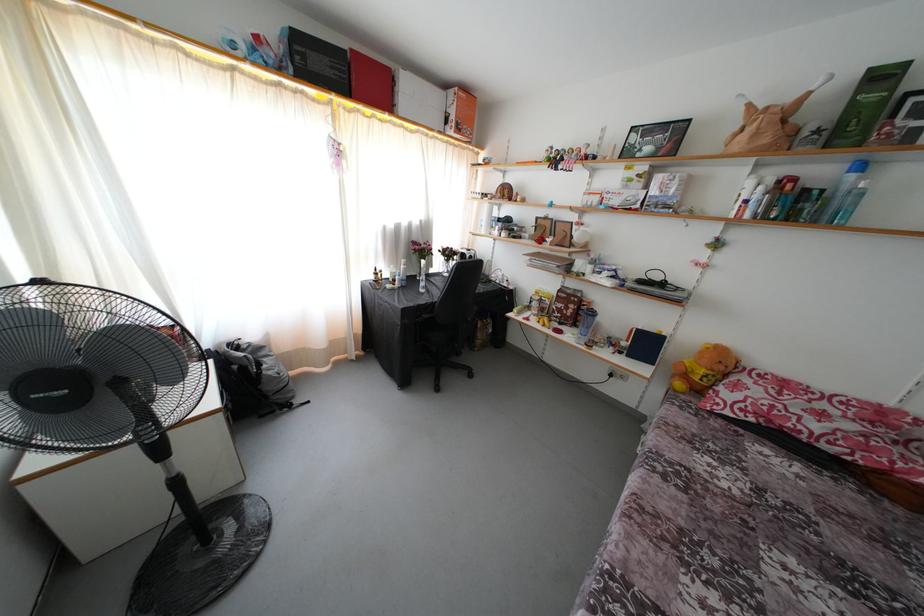
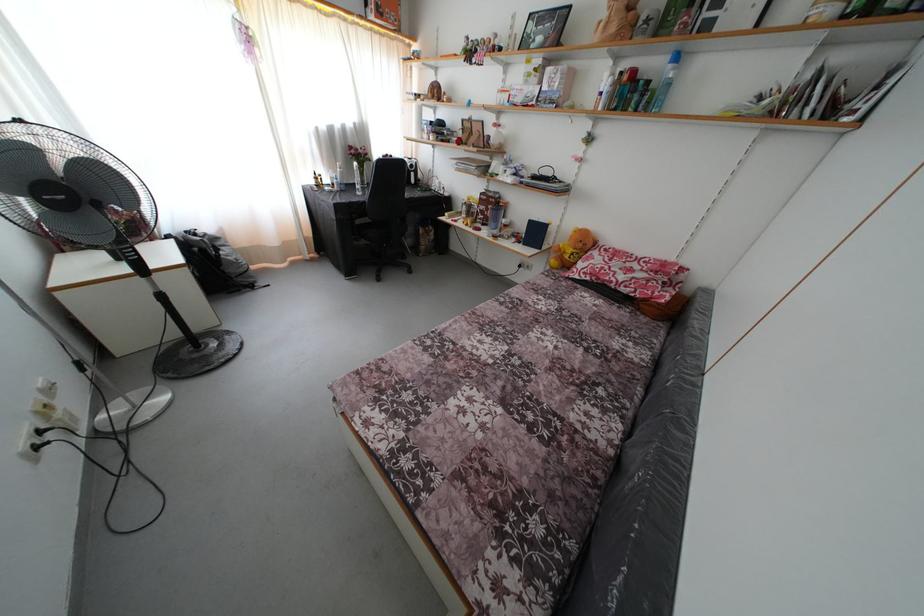
Locate, in the second image, the point that corresponds to pixel 686 413 in the first image.

(552, 282)